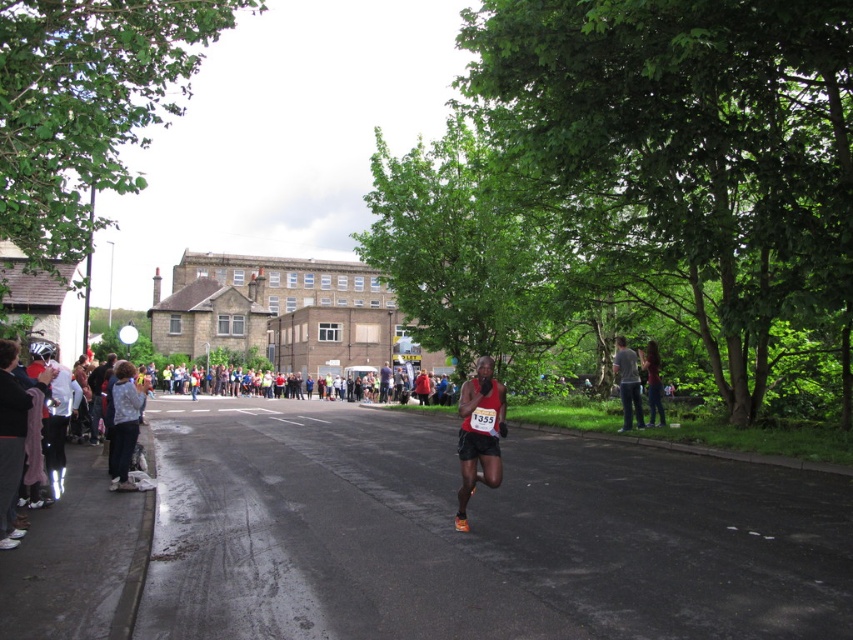
Question: Is denim jacket at right smaller than green leafy tree at right?

Choices:
 (A) no
 (B) yes

Answer: (A)

Question: From the image, what is the correct spatial relationship of red fabric runner at center in relation to denim jacket at left?

Choices:
 (A) left
 (B) right

Answer: (B)

Question: Is red fabric runner at center positioned behind denim jacket at right?

Choices:
 (A) no
 (B) yes

Answer: (A)

Question: Among these objects, which one is farthest from the camera?

Choices:
 (A) denim jacket at left
 (B) denim jacket at right
 (C) black asphalt road at center
 (D) green leafy tree at right

Answer: (D)

Question: Which point appears farthest from the camera in this image?

Choices:
 (A) (492, 484)
 (B) (640, 352)
 (C) (128, 442)
 (D) (614, 349)

Answer: (D)

Question: Which is farther from the black asphalt road at center?

Choices:
 (A) green leafy tree at right
 (B) denim jacket at left
 (C) red fabric runner at center
 (D) denim jacket at right

Answer: (A)